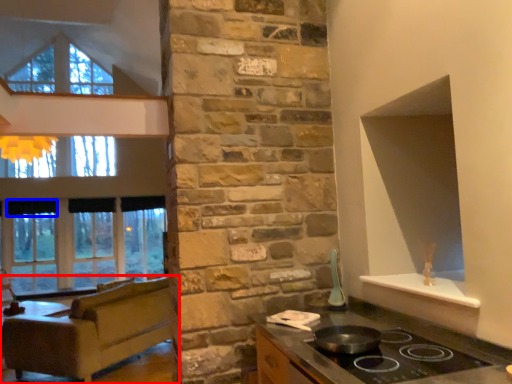
Question: Which object appears closest to the camera in this image, studio couch (highlighted by a red box) or curtain (highlighted by a blue box)?

Choices:
 (A) studio couch
 (B) curtain

Answer: (A)